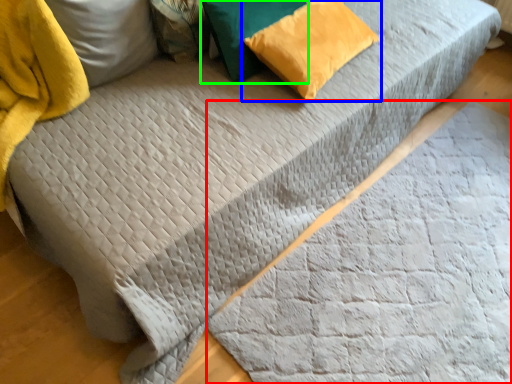
Question: Which object is positioned farthest from blanket (highlighted by a red box)? Select from pillow (highlighted by a blue box) and pillow (highlighted by a green box).

Choices:
 (A) pillow
 (B) pillow

Answer: (B)